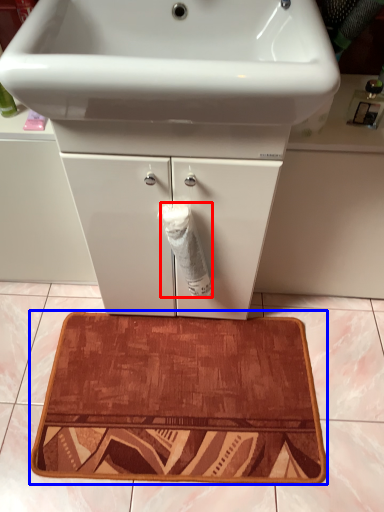
Question: Which point is closer to the camera, toilet paper (highlighted by a red box) or bath mat (highlighted by a blue box)?

Choices:
 (A) toilet paper
 (B) bath mat

Answer: (A)